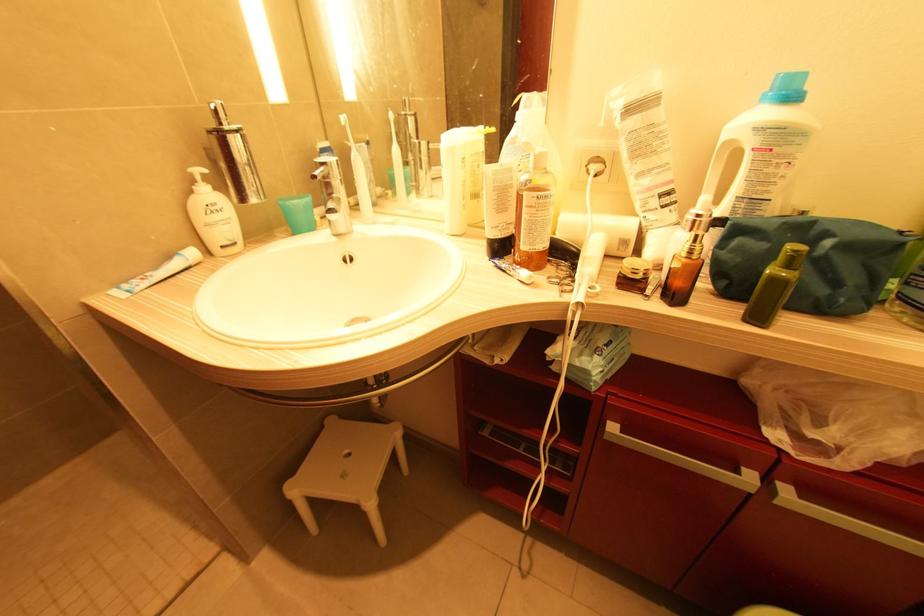
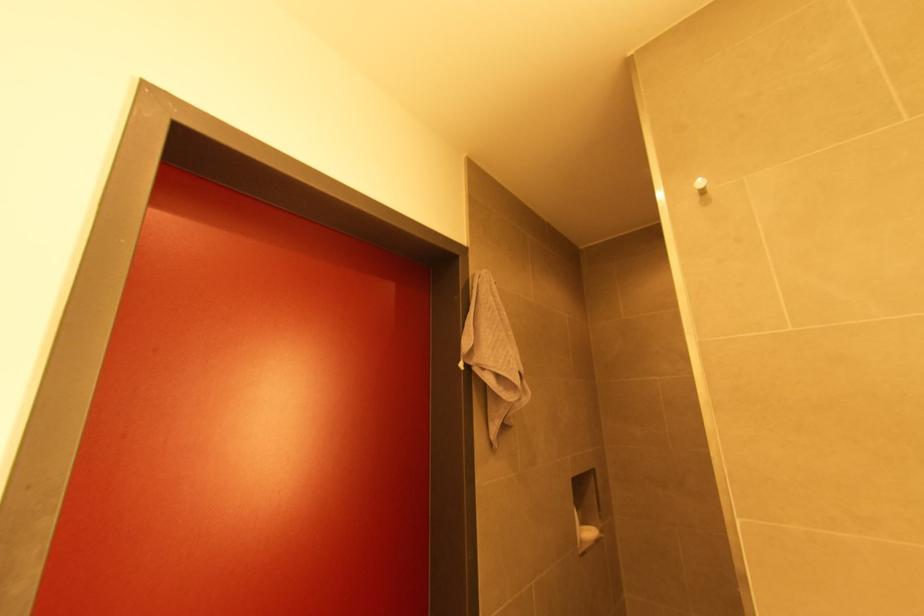
Question: The camera is either moving clockwise (left) or counter-clockwise (right) around the object. The first image is from the beginning of the video and the second image is from the end. Is the camera moving left or right when shooting the video?

Choices:
 (A) Left
 (B) Right

Answer: (B)